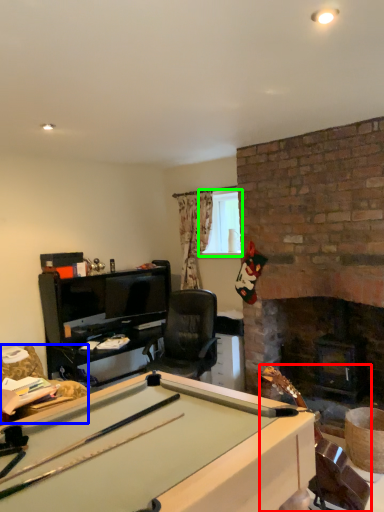
Question: Based on their relative distances, which object is nearer to equipment (highlighted by a red box)? Choose from swivel chair (highlighted by a blue box) and window screen (highlighted by a green box).

Choices:
 (A) swivel chair
 (B) window screen

Answer: (A)